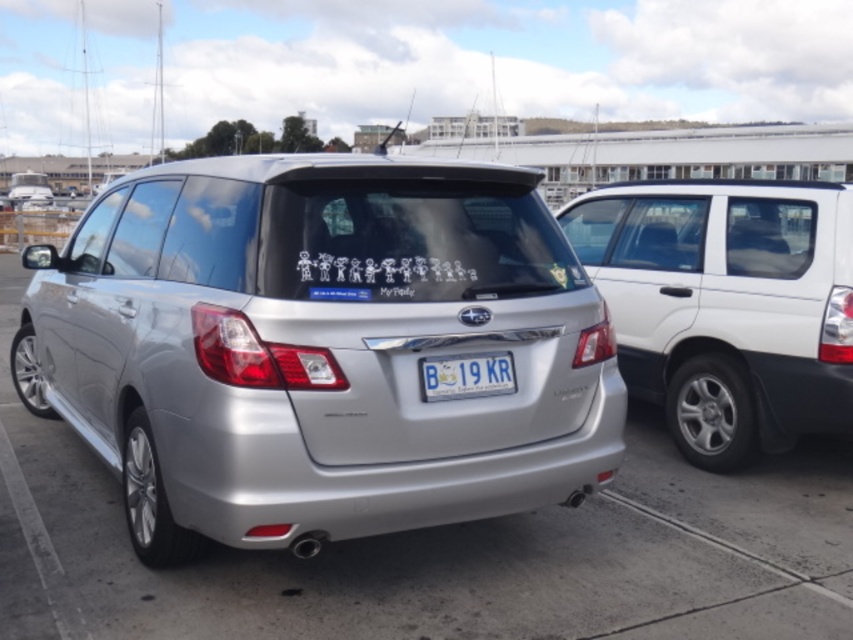
You are standing in front of a silver Subaru parked at a marina parking lot. There is a point marked at coordinates (318, 348). According to the image, what object is this point located on?

The point at coordinates (318, 348) is located on the satin silver car at center.

You are a delivery driver who needs to attach a package to the satin silver car at center. The package must be placed below the white plastic license plate at center. Is this possible given their positions?

The satin silver car at center is located above the white plastic license plate at center, so yes, the package can be placed below the white plastic license plate at center since the car extends above it.

You are standing at the camera position and want to know if you can safely walk around the white matte minivan at right without getting too close. The safety distance is set to 1.5 meters. Can you do that?

The white matte minivan at right is 4.02 meters from camera. Since the safety distance is 1.5 meters, you can safely walk around the white matte minivan at right as the distance is more than enough to maintain the required 1.5 meters.